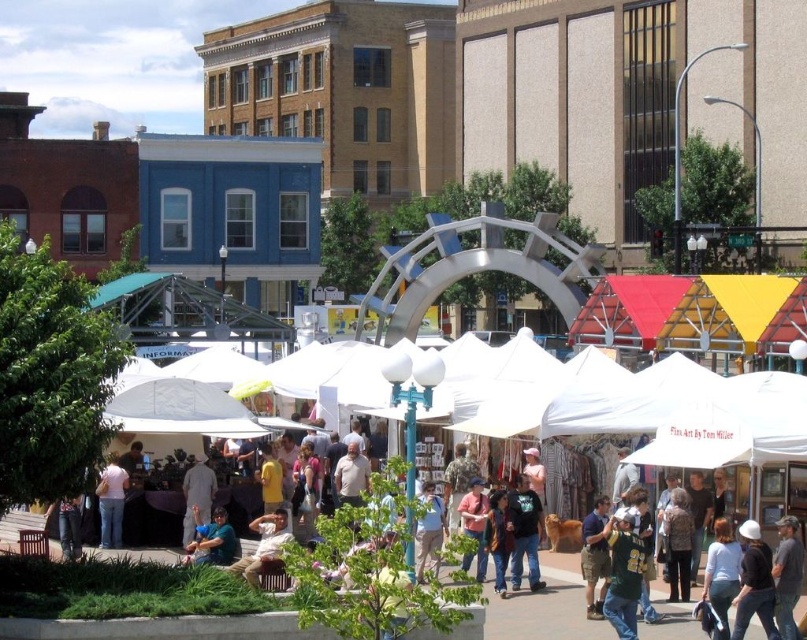
You are at the entrance of the market and want to find the white matte shirt at center. Based on the coordinates provided, in which direction should you walk to locate it?

The white matte shirt at center is located at coordinates point (721,573), which means it is positioned towards the lower right of the scene. You should walk towards the lower right direction to find it.

You are a customer at the market and want to buy a jacket and a shirt. You notice two items in the scene, the denim jacket at lower right and the pink cotton shirt at lower left. Which clothing item is taller?

The pink cotton shirt at lower left is taller than the denim jacket at lower right.